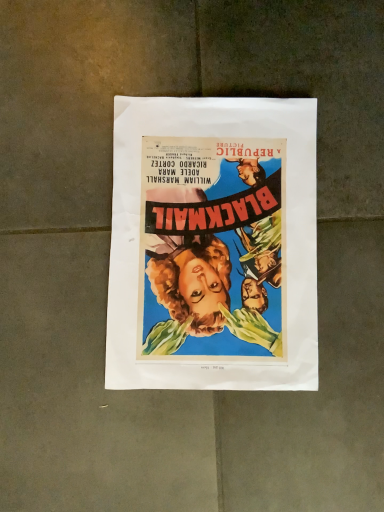
This screenshot has width=384, height=512. What do you see at coordinates (213, 245) in the screenshot?
I see `vibrant paper poster at center` at bounding box center [213, 245].

This screenshot has width=384, height=512. Find the location of `vibrant paper poster at center`. vibrant paper poster at center is located at coordinates (213, 245).

You are a GUI agent. You are given a task and a screenshot of the screen. Output one action in this format:
    pyautogui.click(x=<x>, y=<y>)
    Task: Click on the vibrant paper poster at center
    
    Given the screenshot: What is the action you would take?
    [213, 245]